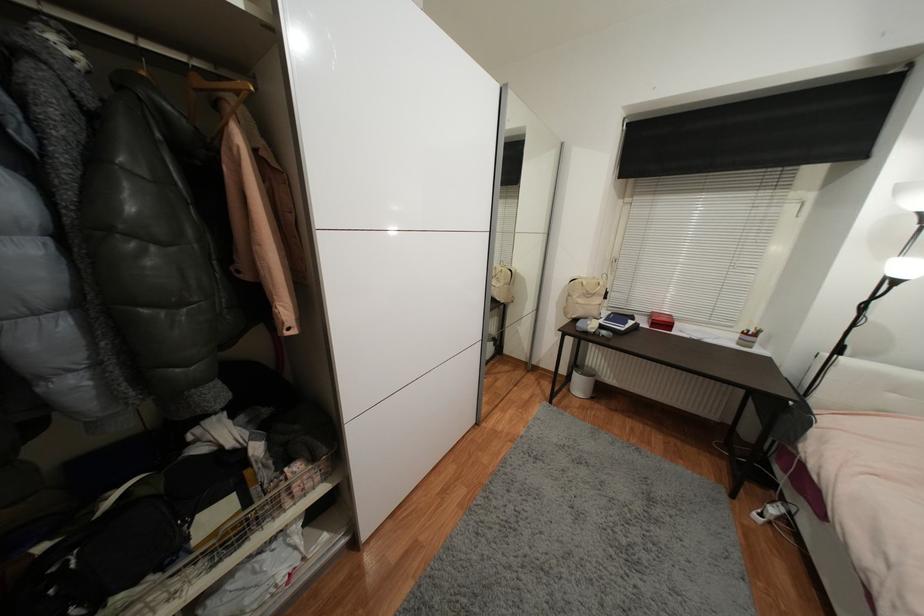
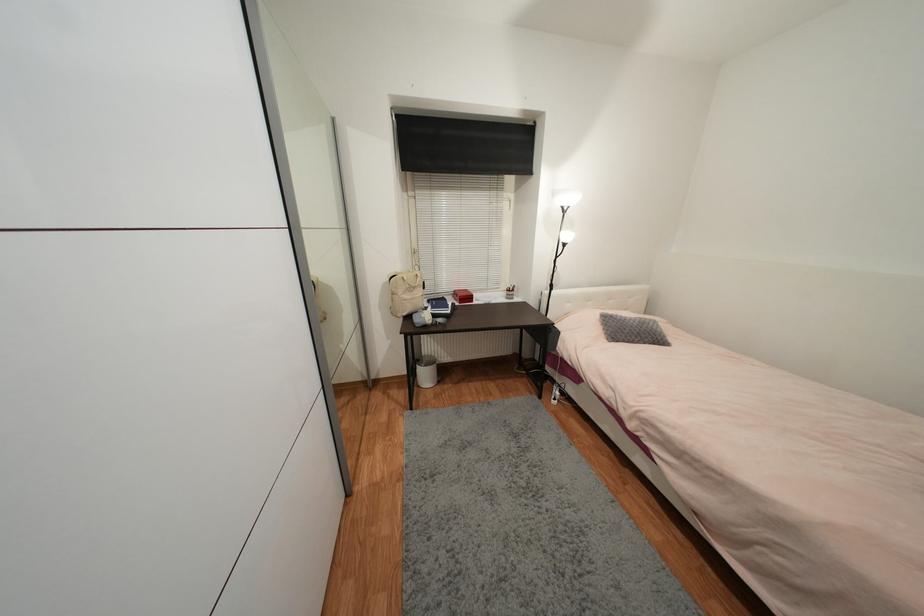
Question: The images are taken continuously from a first-person perspective. In which direction is your viewpoint rotating?

Choices:
 (A) Left
 (B) Right
 (C) Up
 (D) Down

Answer: (B)